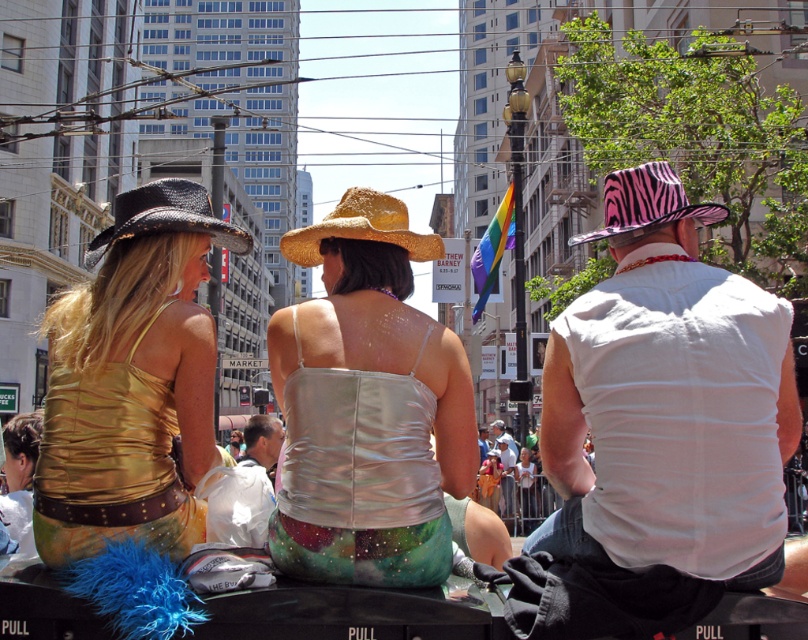
Is gold shiny tank top at upper left to the right of shiny gold tank top at center from the viewer's perspective?

Correct, you'll find gold shiny tank top at upper left to the right of shiny gold tank top at center.

Who is lower down, gold shiny tank top at upper left or shiny gold tank top at center?

shiny gold tank top at center is below.

Does point (182, 328) come in front of point (32, 552)?

Yes, point (182, 328) is closer to viewer.

Identify the location of gold shiny tank top at upper left. (133, 381).

Which is more to the left, pink zebra print cowboy hat at upper right or shiny gold tank top at center?

From the viewer's perspective, shiny gold tank top at center appears more on the left side.

Is point (701, 212) positioned behind point (40, 420)?

No, (701, 212) is closer to viewer.

Is point (634, 209) more distant than point (32, 436)?

No.

Where is `pink zebra print cowboy hat at upper right`? pink zebra print cowboy hat at upper right is located at coordinates (x=646, y=204).

Who is taller, shiny silver tank top at center or white plastic bag at center?

Standing taller between the two is white plastic bag at center.

Image resolution: width=808 pixels, height=640 pixels. Describe the element at coordinates (367, 406) in the screenshot. I see `shiny silver tank top at center` at that location.

Which is in front, point (295, 336) or point (255, 442)?

Point (295, 336) is more forward.

Where is `shiny silver tank top at center`? The width and height of the screenshot is (808, 640). shiny silver tank top at center is located at coordinates (367, 406).